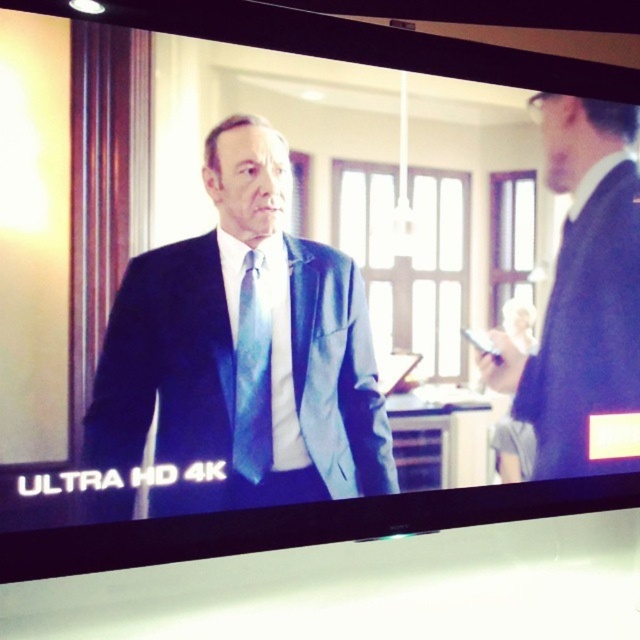
Is satin black suit at right smaller than blue silk tie at center?

Incorrect, satin black suit at right is not smaller in size than blue silk tie at center.

Is satin black suit at right to the left of blue silk tie at center from the viewer's perspective?

Incorrect, satin black suit at right is not on the left side of blue silk tie at center.

Where is `satin black suit at right`? This screenshot has width=640, height=640. satin black suit at right is located at coordinates click(x=582, y=289).

The image size is (640, 640). What do you see at coordinates (243, 352) in the screenshot?
I see `matte blue suit at center` at bounding box center [243, 352].

Which is below, matte blue suit at center or blue silk tie at center?

blue silk tie at center is below.

Does point (150, 353) come behind point (262, 342)?

No, it is not.

This screenshot has width=640, height=640. I want to click on matte blue suit at center, so click(x=243, y=352).

Can you confirm if matte blue suit at center is smaller than satin black suit at right?

No, matte blue suit at center is not smaller than satin black suit at right.

Which of these two, matte blue suit at center or satin black suit at right, stands shorter?

With less height is matte blue suit at center.

Is point (355, 394) positioned in front of point (573, 294)?

Yes, it is.

The image size is (640, 640). What are the coordinates of `matte blue suit at center` in the screenshot? It's located at (243, 352).